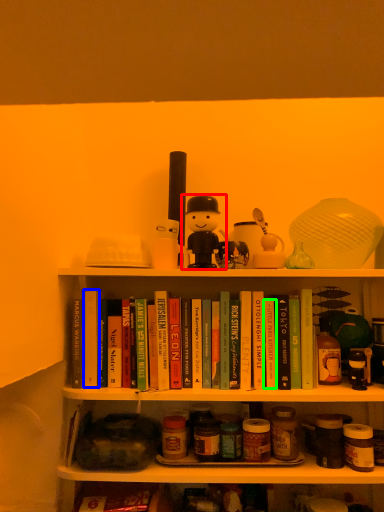
Question: Considering the real-world distances, which object is farthest from toy (highlighted by a red box)? paperback book (highlighted by a blue box) or paperback book (highlighted by a green box)?

Choices:
 (A) paperback book
 (B) paperback book

Answer: (A)